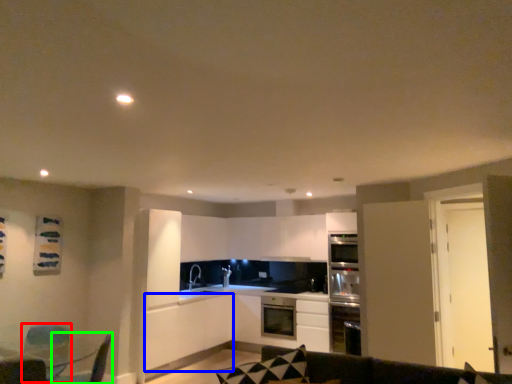
Question: Estimate the real-world distances between objects in this image. Which object is closer to swivel chair (highlighted by a red box), cabinetry (highlighted by a blue box) or swivel chair (highlighted by a green box)?

Choices:
 (A) cabinetry
 (B) swivel chair

Answer: (B)